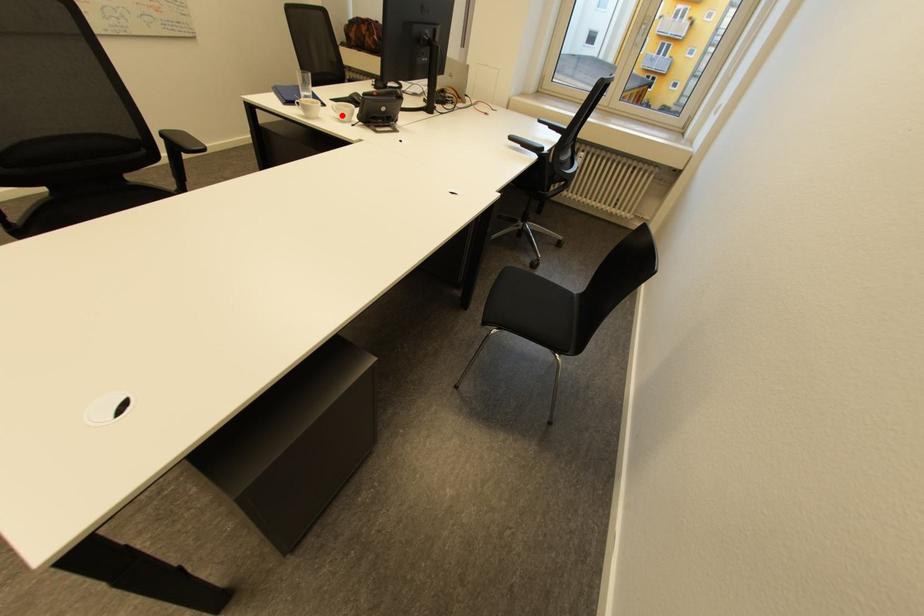
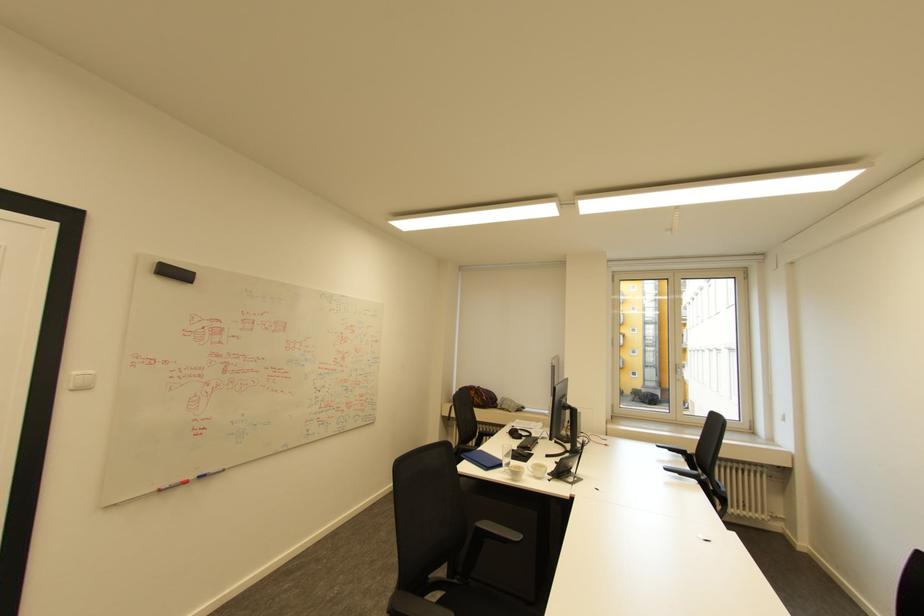
Where in the second image is the point corresponding to the highlighted location from the first image?

(539, 474)